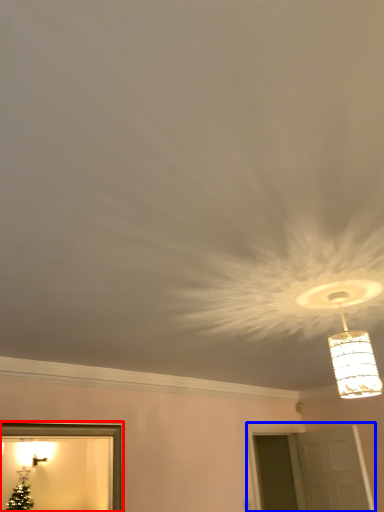
Question: Which object appears closest to the camera in this image, picture frame (highlighted by a red box) or window (highlighted by a blue box)?

Choices:
 (A) picture frame
 (B) window

Answer: (A)